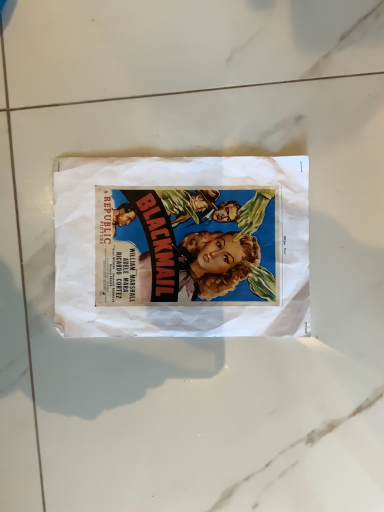
This screenshot has height=512, width=384. What are the coordinates of `empty space that is ontop of matte paper poster at center (from a real-world perspective)` in the screenshot? It's located at (212, 234).